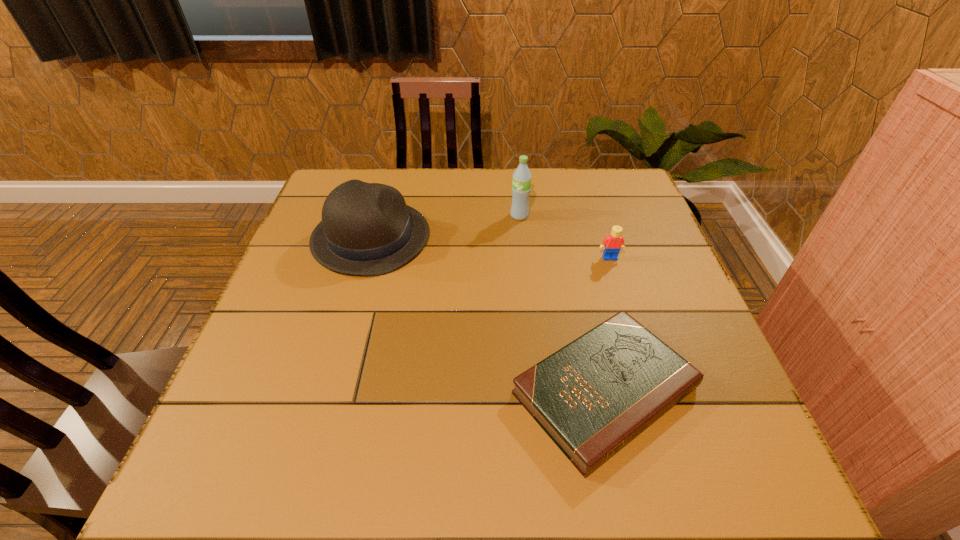
In order to click on unoccupied position between the bowler hat and the nearest object in this screenshot , I will do `click(488, 314)`.

This screenshot has width=960, height=540. What are the coordinates of `free space between the leftmost object and the tallest object` in the screenshot? It's located at (445, 227).

This screenshot has width=960, height=540. What are the coordinates of `object that stands as the third closest to the leftmost object` in the screenshot? It's located at (614, 242).

This screenshot has width=960, height=540. I want to click on object that is the third closest to the Lego, so click(x=367, y=229).

In order to click on vacant space that satisfies the following two spatial constraints: 1. on the front-facing side of the Bible; 2. on the left side of the leftmost object in this screenshot , I will do `click(327, 391)`.

Locate an element on the screen. The image size is (960, 540). free region that satisfies the following two spatial constraints: 1. on the front side of the tallest object; 2. on the front-facing side of the second tallest object is located at coordinates (521, 238).

Where is `vacant space that satisfies the following two spatial constraints: 1. on the front side of the water bottle; 2. on the front-facing side of the leftmost object`? This screenshot has width=960, height=540. vacant space that satisfies the following two spatial constraints: 1. on the front side of the water bottle; 2. on the front-facing side of the leftmost object is located at coordinates (521, 238).

At what (x,y) coordinates should I click in order to perform the action: click on free space in the image that satisfies the following two spatial constraints: 1. on the front-facing side of the second tallest object; 2. on the back side of the nearest object. Please return your answer as a coordinate pair (x, y). Image resolution: width=960 pixels, height=540 pixels. Looking at the image, I should click on (327, 391).